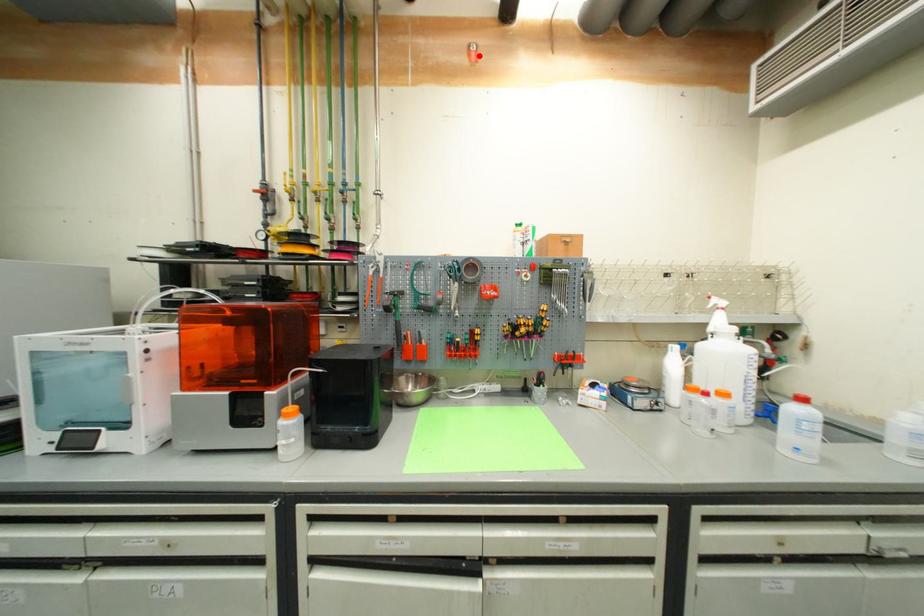
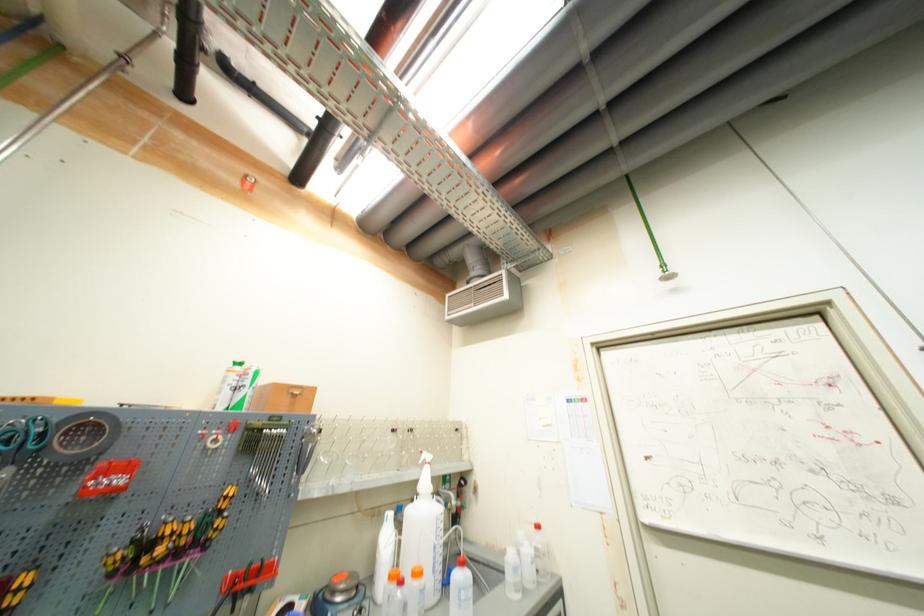
Find the pixel in the second image that matches the highlighted location in the first image.

(253, 185)